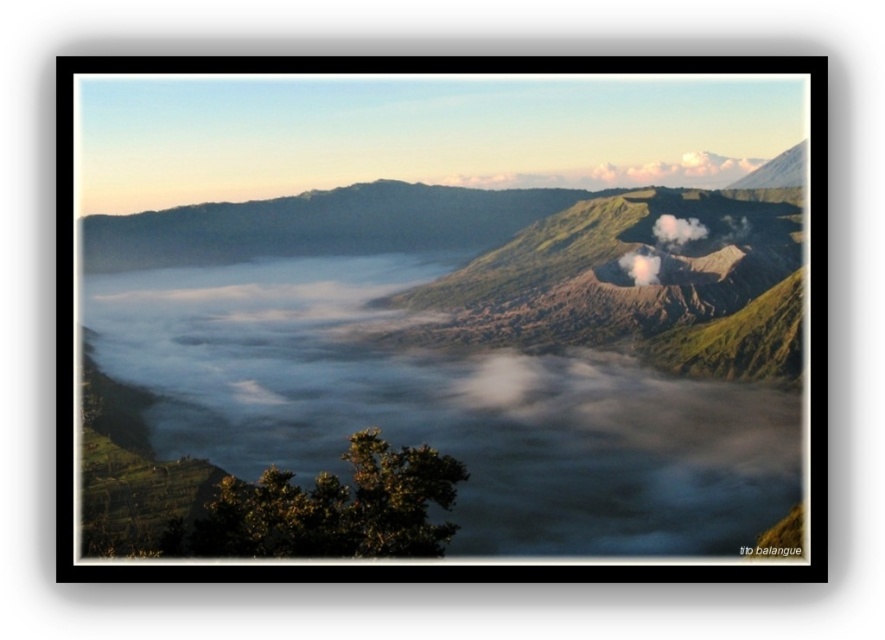
Consider the image. You are an environmental scientist observing the volcanic activity. You notice two white smoke plumes in the image. Which one is located higher up in the sky between the white smoke at upper right and the white smoke at center?

The white smoke at upper right is positioned over the white smoke at center, meaning it is higher up in the sky.